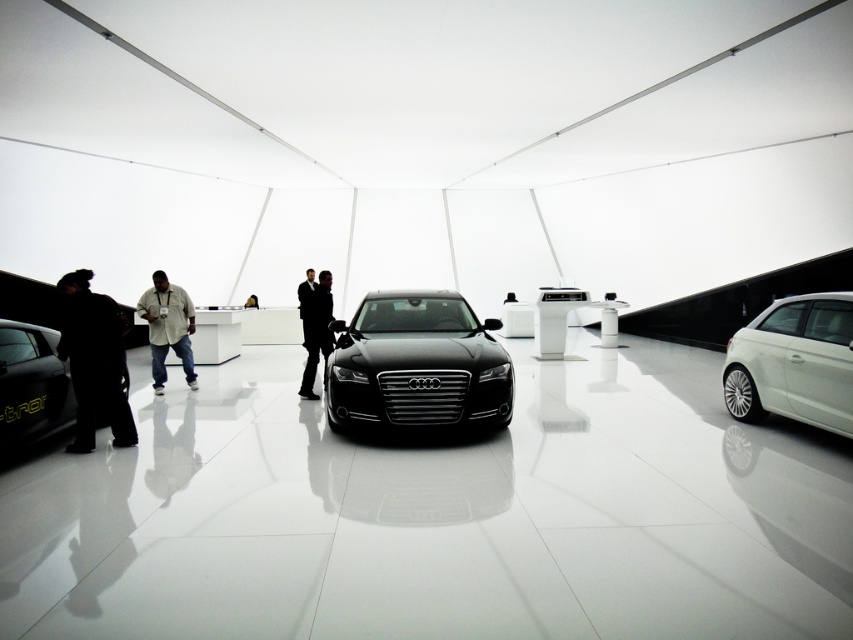
Question: Does black suit at center have a greater width compared to black leather jacket at center?

Choices:
 (A) yes
 (B) no

Answer: (A)

Question: Among these points, which one is farthest from the camera?

Choices:
 (A) (7, 406)
 (B) (312, 396)

Answer: (B)

Question: Among these objects, which one is nearest to the camera?

Choices:
 (A) glossy black car at center
 (B) light beige shirt at center
 (C) matte black car at lower left

Answer: (C)

Question: Which object is closer to the camera taking this photo?

Choices:
 (A) light beige shirt at center
 (B) black leather jacket at center
 (C) white metallic hatchback at right

Answer: (C)

Question: Does white metallic hatchback at right lie in front of dark matte jacket at left?

Choices:
 (A) no
 (B) yes

Answer: (B)

Question: Can you confirm if black suit at center is smaller than black leather jacket at center?

Choices:
 (A) yes
 (B) no

Answer: (B)